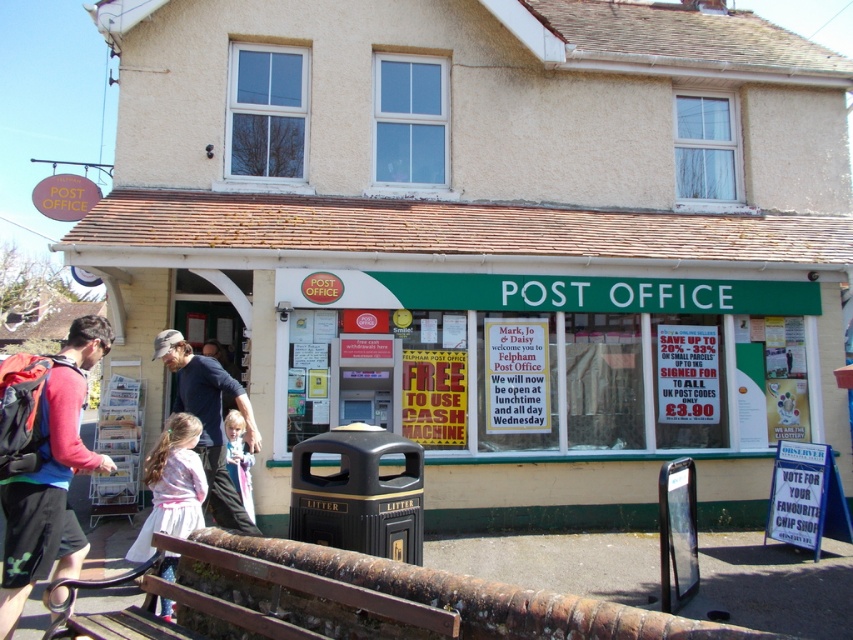
Can you confirm if red backpack at left is positioned to the right of matte blue shirt at left?

Incorrect, red backpack at left is not on the right side of matte blue shirt at left.

Between red backpack at left and matte blue shirt at left, which one is positioned higher?

matte blue shirt at left

Is point (74, 460) positioned before point (207, 381)?

That is True.

At what (x,y) coordinates should I click in order to perform the action: click on red backpack at left. Please return your answer as a coordinate pair (x, y). Image resolution: width=853 pixels, height=640 pixels. Looking at the image, I should click on (51, 477).

Does rusty metal bench at lower left appear on the left side of light pink fabric dress at lower left?

No, rusty metal bench at lower left is not to the left of light pink fabric dress at lower left.

Describe the element at coordinates (776, 582) in the screenshot. I see `rusty metal bench at lower left` at that location.

Is point (769, 552) in front of point (155, 506)?

No, it is not.

This screenshot has height=640, width=853. What are the coordinates of `rusty metal bench at lower left` in the screenshot? It's located at (776, 582).

Does red backpack at left appear under light pink fabric dress at lower left?

Yes, red backpack at left is below light pink fabric dress at lower left.

Find the location of `red backpack at left`. red backpack at left is located at coordinates (51, 477).

This screenshot has height=640, width=853. Describe the element at coordinates (51, 477) in the screenshot. I see `red backpack at left` at that location.

Where is `red backpack at left`? The width and height of the screenshot is (853, 640). red backpack at left is located at coordinates (51, 477).